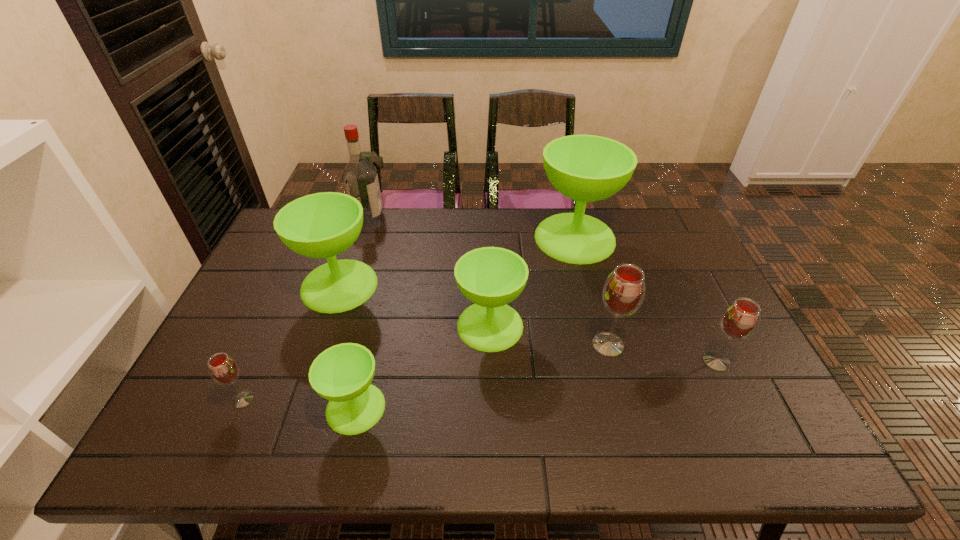
Where is `liquor`? liquor is located at coordinates (360, 178).

This screenshot has height=540, width=960. I want to click on the biggest green wineglass, so click(x=586, y=168).

Where is `the rightmost green wineglass`? the rightmost green wineglass is located at coordinates (586, 168).

This screenshot has height=540, width=960. I want to click on the third smallest green wineglass, so click(x=322, y=225).

Identify the location of the biggest red wineglass. (623, 293).

I want to click on the second green wineglass from right to left, so click(490, 277).

Where is `the fourth object from right to left`? The image size is (960, 540). the fourth object from right to left is located at coordinates (490, 277).

The width and height of the screenshot is (960, 540). In order to click on the rightmost wineglass in this screenshot , I will do `click(740, 319)`.

Find the location of a particular element. The height and width of the screenshot is (540, 960). the rightmost object is located at coordinates (740, 319).

Where is `the leftmost red wineglass`? The height and width of the screenshot is (540, 960). the leftmost red wineglass is located at coordinates (223, 369).